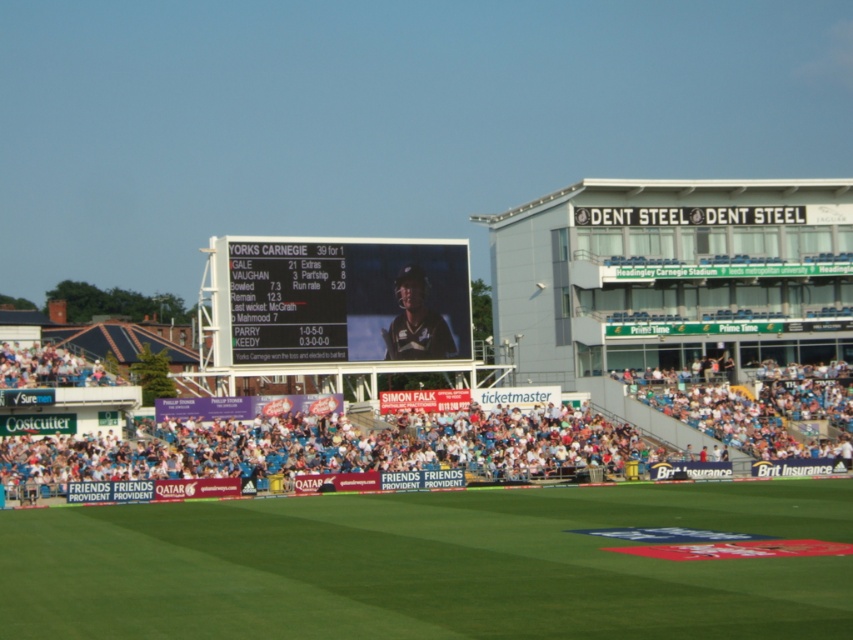
You are a photographer standing at the edge of the cricket pitch. You want to take a photo that includes both the green grass at center and the black plastic scoreboard at center. Based on their positions, which object will appear closer to the camera in the photo?

The green grass at center is in front of the black plastic scoreboard at center, so it will appear closer to the camera in the photo.

You are a spectator at the cricket stadium and want to find a clear view of the pitch. You notice the green grass at center and the white fabric crowd at lower center. Which object is closer to the pitch, and why?

The green grass at center is closer to the pitch because it is positioned below the white fabric crowd at lower center, meaning it is situated nearer to the playing area.